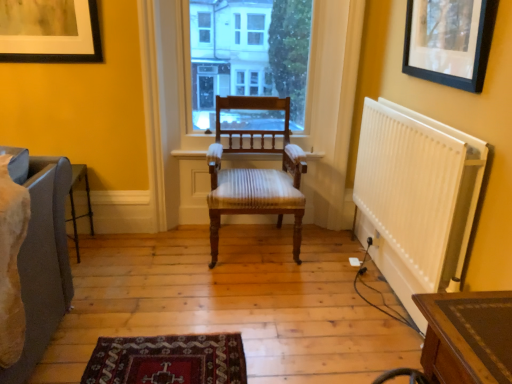
The image size is (512, 384). What do you see at coordinates (419, 188) in the screenshot?
I see `white plastic radiator at right` at bounding box center [419, 188].

At what (x,y) coordinates should I click in order to perform the action: click on matte black picture frame at upper left, arranged as the 1th picture frame when viewed from the back. Please return your answer as a coordinate pair (x, y). This screenshot has height=384, width=512. Looking at the image, I should click on (49, 31).

Does wooden chair at center have a larger size compared to transparent glass window at center?

Indeed, wooden chair at center has a larger size compared to transparent glass window at center.

Considering their positions, is wooden chair at center located in front of or behind transparent glass window at center?

wooden chair at center is positioned closer to the viewer than transparent glass window at center.

How different are the orientations of wooden chair at center and transparent glass window at center in degrees?

The angle between the facing direction of wooden chair at center and the facing direction of transparent glass window at center is 2.87 degrees.

Does wooden chair at center appear on the right side of transparent glass window at center?

Indeed, wooden chair at center is positioned on the right side of transparent glass window at center.

Is matte black picture frame at upper left, marked as the first picture frame in a left-to-right arrangement, directly adjacent to black matte picture frame at upper right, placed as the 2th picture frame when sorted from left to right?

No, matte black picture frame at upper left, marked as the first picture frame in a left-to-right arrangement, is not touching black matte picture frame at upper right, placed as the 2th picture frame when sorted from left to right.

Considering the sizes of objects matte black picture frame at upper left, arranged as the 1th picture frame when viewed from the back, and black matte picture frame at upper right, the 1th picture frame from the right, in the image provided, who is taller, matte black picture frame at upper left, arranged as the 1th picture frame when viewed from the back, or black matte picture frame at upper right, the 1th picture frame from the right,?

Standing taller between the two is black matte picture frame at upper right, the 1th picture frame from the right.

Is matte black picture frame at upper left, the second picture frame from the right, wider or thinner than black matte picture frame at upper right, the 1th picture frame from the right?

Considering their sizes, matte black picture frame at upper left, the second picture frame from the right, looks broader than black matte picture frame at upper right, the 1th picture frame from the right.

Is black matte picture frame at upper right, the 2th picture frame viewed from the back, taller or shorter than wooden chair at center?

In the image, black matte picture frame at upper right, the 2th picture frame viewed from the back, appears to be shorter than wooden chair at center.

Looking at this image, considering the relative sizes of black matte picture frame at upper right, the 2th picture frame viewed from the back, and wooden chair at center in the image provided, is black matte picture frame at upper right, the 2th picture frame viewed from the back, wider than wooden chair at center?

In fact, black matte picture frame at upper right, the 2th picture frame viewed from the back, might be narrower than wooden chair at center.

How different are the orientations of black matte picture frame at upper right, which is the 1th picture frame from front to back, and wooden chair at center in degrees?

There is a 88.7-degree angle between the facing directions of black matte picture frame at upper right, which is the 1th picture frame from front to back, and wooden chair at center.

Is black matte picture frame at upper right, the 2th picture frame viewed from the back, oriented towards wooden chair at center?

No, black matte picture frame at upper right, the 2th picture frame viewed from the back, is not aimed at wooden chair at center.

Is wooden chair at center completely or partially outside of white plastic radiator at right?

Indeed, wooden chair at center is completely outside white plastic radiator at right.

What are the coordinates of `chair behind the white plastic radiator at right` in the screenshot? It's located at (255, 172).

Is wooden chair at center positioned in front of white plastic radiator at right?

No, wooden chair at center is behind white plastic radiator at right.

Locate an element on the screen. radiator beneath the black matte picture frame at upper right, which is the 1th picture frame from front to back (from a real-world perspective) is located at coordinates (419, 188).

Can you tell me how much white plastic radiator at right and black matte picture frame at upper right, the 2th picture frame viewed from the back, differ in facing direction?

The angular difference between white plastic radiator at right and black matte picture frame at upper right, the 2th picture frame viewed from the back, is 0.464 degrees.

Is white plastic radiator at right with black matte picture frame at upper right, the 1th picture frame from the right?

No, white plastic radiator at right is not in contact with black matte picture frame at upper right, the 1th picture frame from the right.

Is white plastic radiator at right positioned with its back to black matte picture frame at upper right, the 1th picture frame from the right?

white plastic radiator at right is not turned away from black matte picture frame at upper right, the 1th picture frame from the right.

Is matte black picture frame at upper left, marked as the first picture frame in a left-to-right arrangement, to the left or to the right of wooden chair at center in the image?

From the image, it's evident that matte black picture frame at upper left, marked as the first picture frame in a left-to-right arrangement, is to the left of wooden chair at center.

From the image's perspective, does matte black picture frame at upper left, arranged as the 1th picture frame when viewed from the back, appear lower than wooden chair at center?

No.

Is matte black picture frame at upper left, marked as the first picture frame in a left-to-right arrangement, positioned with its back to wooden chair at center?

matte black picture frame at upper left, marked as the first picture frame in a left-to-right arrangement, does not have its back to wooden chair at center.

Is matte black picture frame at upper left, the second picture frame from the right, not within wooden chair at center?

matte black picture frame at upper left, the second picture frame from the right, lies outside wooden chair at center's area.

How distant is black matte picture frame at upper right, the 1th picture frame from the right, from white plastic radiator at right?

They are 17.46 inches apart.

From a real-world perspective, which object stands above the other?

black matte picture frame at upper right, placed as the 2th picture frame when sorted from left to right, is physically above.

Is black matte picture frame at upper right, the 1th picture frame from the right, facing towards white plastic radiator at right?

No, black matte picture frame at upper right, the 1th picture frame from the right, is not facing towards white plastic radiator at right.

Based on their sizes in the image, would you say black matte picture frame at upper right, which is the 1th picture frame from front to back, is bigger or smaller than white plastic radiator at right?

black matte picture frame at upper right, which is the 1th picture frame from front to back, is smaller than white plastic radiator at right.

Image resolution: width=512 pixels, height=384 pixels. I want to click on chair on the right of transparent glass window at center, so click(255, 172).

This screenshot has height=384, width=512. I want to click on picture frame positioned vertically above the matte black picture frame at upper left, arranged as the 1th picture frame when viewed from the back (from a real-world perspective), so click(x=449, y=41).

Estimate the real-world distances between objects in this image. Which object is closer to matte black picture frame at upper left, marked as the first picture frame in a left-to-right arrangement, white plastic radiator at right or black matte picture frame at upper right, the 2th picture frame viewed from the back?

Based on the image, white plastic radiator at right appears to be nearer to matte black picture frame at upper left, marked as the first picture frame in a left-to-right arrangement.

Estimate the real-world distances between objects in this image. Which object is closer to transparent glass window at center, wooden chair at center or matte black picture frame at upper left, marked as the first picture frame in a left-to-right arrangement?

Among the two, wooden chair at center is located nearer to transparent glass window at center.

When comparing their distances from transparent glass window at center, does black matte picture frame at upper right, which is the 1th picture frame from front to back, or white plastic radiator at right seem further?

Among the two, black matte picture frame at upper right, which is the 1th picture frame from front to back, is located further to transparent glass window at center.

Estimate the real-world distances between objects in this image. Which object is closer to transparent glass window at center, white plastic radiator at right or wooden chair at center?

wooden chair at center.

From the image, which object appears to be farther from white plastic radiator at right, black matte picture frame at upper right, which is the 1th picture frame from front to back, or matte black picture frame at upper left, the second picture frame from the front?

The object further to white plastic radiator at right is matte black picture frame at upper left, the second picture frame from the front.

Looking at the image, which one is located closer to transparent glass window at center, matte black picture frame at upper left, the second picture frame from the front, or wooden chair at center?

Based on the image, wooden chair at center appears to be nearer to transparent glass window at center.

Which object lies further to the anchor point white plastic radiator at right, black matte picture frame at upper right, placed as the 2th picture frame when sorted from left to right, or wooden chair at center?

wooden chair at center lies further to white plastic radiator at right than the other object.

Which object lies further to the anchor point transparent glass window at center, matte black picture frame at upper left, arranged as the 1th picture frame when viewed from the back, or black matte picture frame at upper right, the 2th picture frame viewed from the back?

black matte picture frame at upper right, the 2th picture frame viewed from the back.

Locate an element on the screen. Image resolution: width=512 pixels, height=384 pixels. window situated between matte black picture frame at upper left, marked as the first picture frame in a left-to-right arrangement, and wooden chair at center from left to right is located at coordinates (248, 53).

Where is `chair between black matte picture frame at upper right, the 1th picture frame from the right, and transparent glass window at center, along the z-axis`? Image resolution: width=512 pixels, height=384 pixels. chair between black matte picture frame at upper right, the 1th picture frame from the right, and transparent glass window at center, along the z-axis is located at coordinates (255, 172).

Where is `chair between matte black picture frame at upper left, marked as the first picture frame in a left-to-right arrangement, and white plastic radiator at right`? The image size is (512, 384). chair between matte black picture frame at upper left, marked as the first picture frame in a left-to-right arrangement, and white plastic radiator at right is located at coordinates (255, 172).

I want to click on window between matte black picture frame at upper left, the second picture frame from the right, and black matte picture frame at upper right, the 2th picture frame viewed from the back, in the horizontal direction, so click(x=248, y=53).